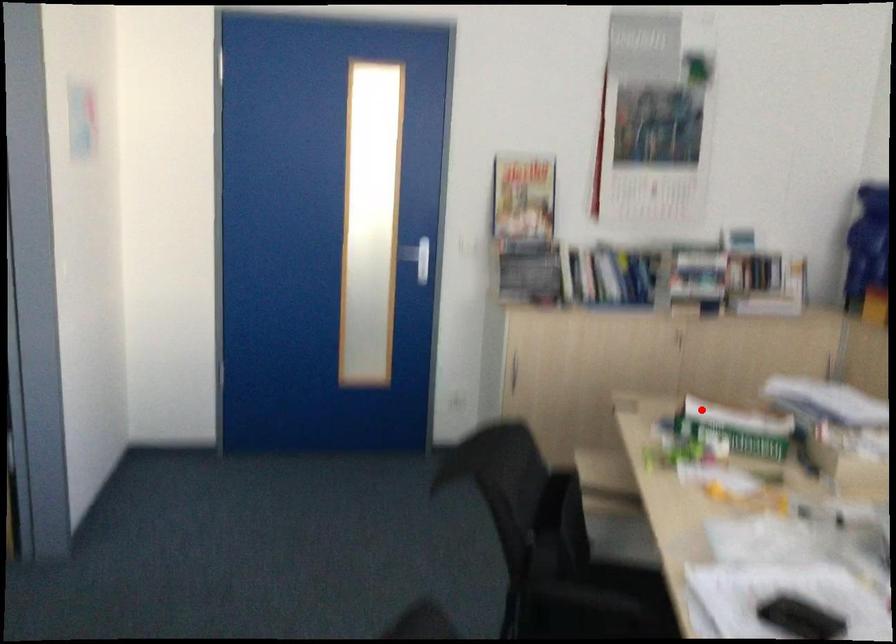
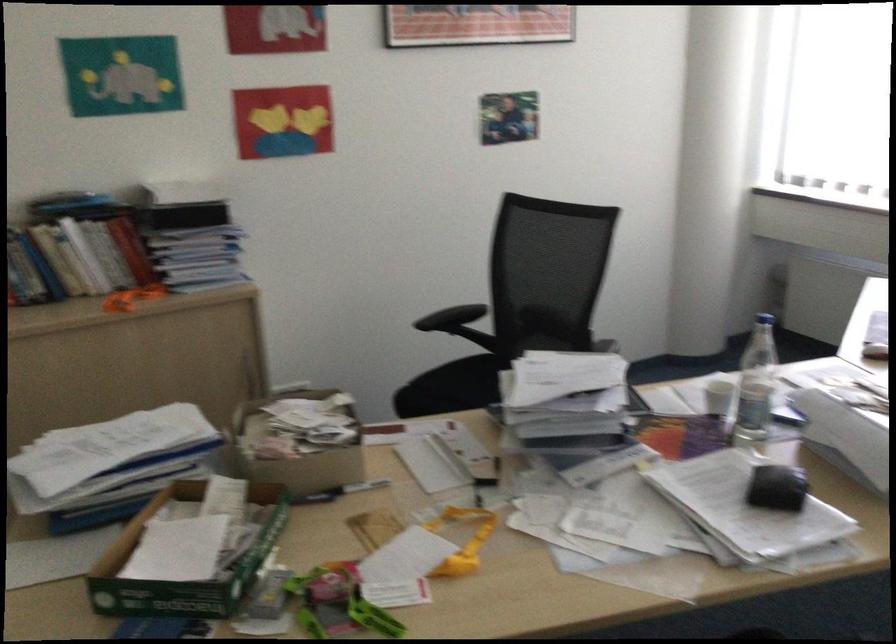
Locate, in the second image, the point that corresponds to the highlighted location in the first image.

(184, 564)